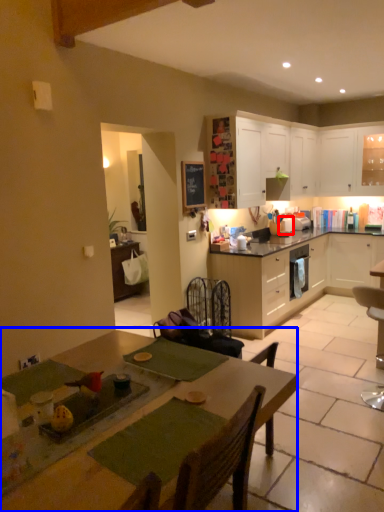
Question: Which of the following is the farthest to the observer, appliance (highlighted by a red box) or table (highlighted by a blue box)?

Choices:
 (A) appliance
 (B) table

Answer: (A)